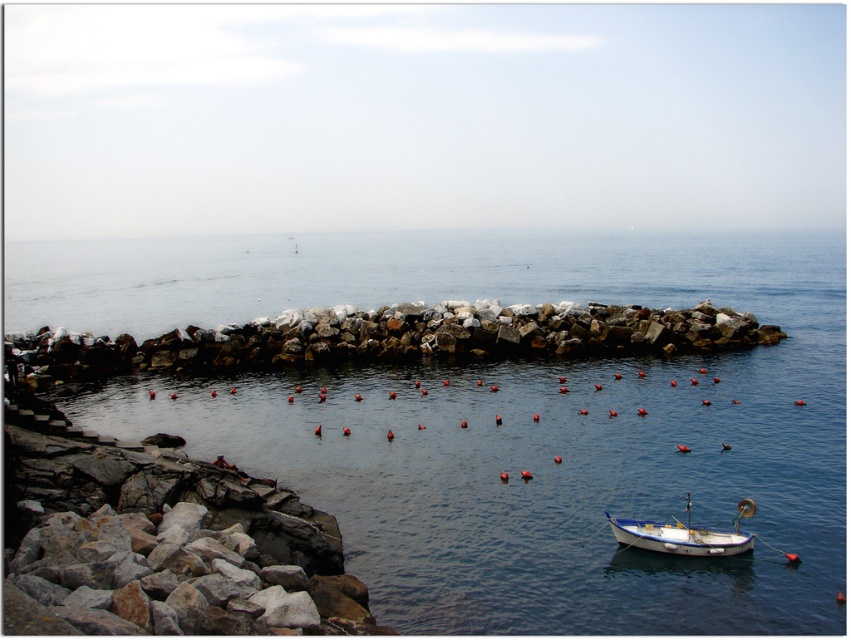
Question: Does blue water at center have a smaller size compared to blue polished wood boat at lower right?

Choices:
 (A) yes
 (B) no

Answer: (B)

Question: Based on their relative distances, which object is farther from the rockyrough stonerocky barrier at center?

Choices:
 (A) blue water at center
 (B) blue polished wood boat at lower right

Answer: (A)

Question: Which of these objects is positioned farthest from the rockyrough stonerocky barrier at center?

Choices:
 (A) blue water at center
 (B) blue polished wood boat at lower right

Answer: (A)

Question: Can you confirm if rockyrough stonerocky barrier at center is smaller than blue polished wood boat at lower right?

Choices:
 (A) yes
 (B) no

Answer: (B)

Question: Does blue water at center have a lesser width compared to rockyrough stonerocky barrier at center?

Choices:
 (A) no
 (B) yes

Answer: (A)

Question: Which object is positioned closest to the blue polished wood boat at lower right?

Choices:
 (A) rockyrough stonerocky barrier at center
 (B) blue water at center

Answer: (A)